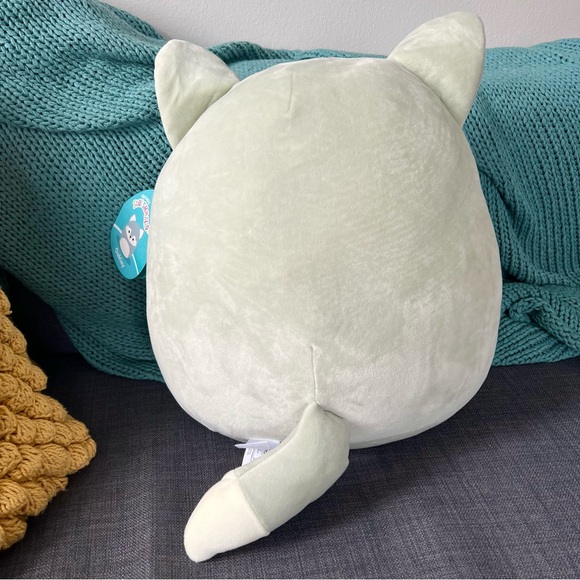
At what (x,y) coordinates should I click in order to perform the action: click on carpet. Please return your answer as a coordinate pair (x, y). The image size is (580, 580). Looking at the image, I should click on (176, 506).